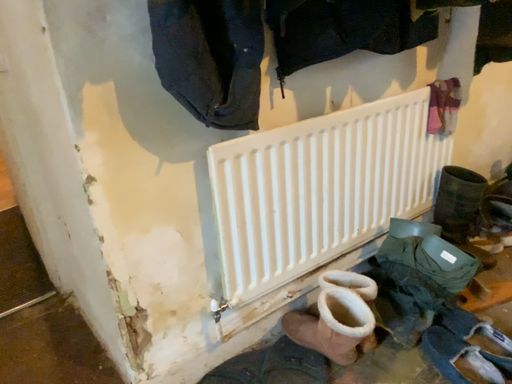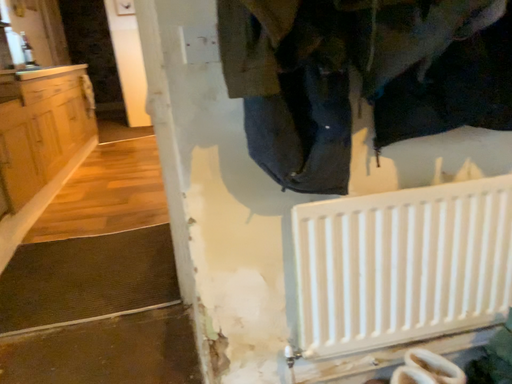
Question: How did the camera likely rotate when shooting the video?

Choices:
 (A) rotated left
 (B) rotated right

Answer: (A)